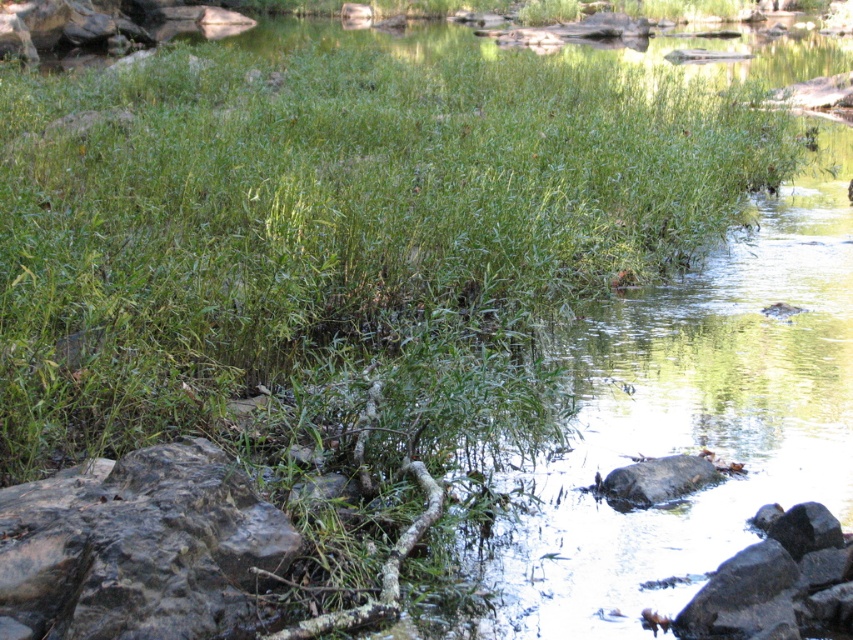
Question: Considering the real-world distances, which object is farthest from the smooth gray rock at center?

Choices:
 (A) smooth gray rock at lower right
 (B) gray rough rock at lower left

Answer: (B)

Question: Is gray rough rock at lower left wider than smooth gray rock at lower right?

Choices:
 (A) yes
 (B) no

Answer: (A)

Question: Does gray rough rock at lower left lie in front of smooth gray rock at center?

Choices:
 (A) no
 (B) yes

Answer: (B)

Question: Can you confirm if smooth gray rock at lower right is positioned to the left of smooth gray rock at center?

Choices:
 (A) yes
 (B) no

Answer: (B)

Question: Which object is farther from the camera taking this photo?

Choices:
 (A) smooth gray rock at center
 (B) smooth gray rock at lower right

Answer: (A)

Question: Estimate the real-world distances between objects in this image. Which object is farther from the gray rough rock at lower left?

Choices:
 (A) smooth gray rock at center
 (B) smooth gray rock at lower right

Answer: (A)